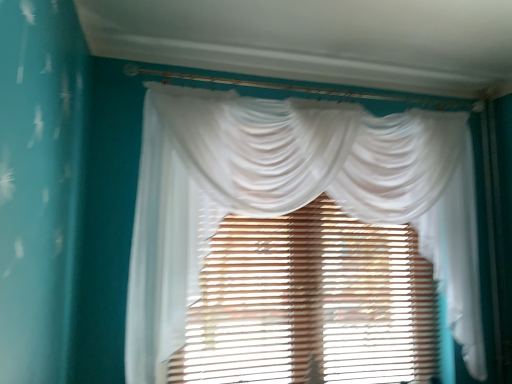
Question: Considering the relative sizes of translucent wood blinds at center and white sheer curtain at center in the image provided, is translucent wood blinds at center bigger than white sheer curtain at center?

Choices:
 (A) no
 (B) yes

Answer: (A)

Question: Is translucent wood blinds at center oriented away from white sheer curtain at center?

Choices:
 (A) no
 (B) yes

Answer: (B)

Question: Are translucent wood blinds at center and white sheer curtain at center beside each other?

Choices:
 (A) yes
 (B) no

Answer: (B)

Question: Can you confirm if translucent wood blinds at center is positioned to the right of white sheer curtain at center?

Choices:
 (A) no
 (B) yes

Answer: (A)

Question: Can you confirm if translucent wood blinds at center is smaller than white sheer curtain at center?

Choices:
 (A) yes
 (B) no

Answer: (A)

Question: Considering the relative sizes of translucent wood blinds at center and white sheer curtain at center in the image provided, is translucent wood blinds at center shorter than white sheer curtain at center?

Choices:
 (A) no
 (B) yes

Answer: (B)

Question: Is white sheer curtain at center taller than translucent wood blinds at center?

Choices:
 (A) yes
 (B) no

Answer: (A)

Question: Is white sheer curtain at center with translucent wood blinds at center?

Choices:
 (A) yes
 (B) no

Answer: (B)

Question: Considering the relative sizes of white sheer curtain at center and translucent wood blinds at center in the image provided, is white sheer curtain at center wider than translucent wood blinds at center?

Choices:
 (A) no
 (B) yes

Answer: (B)

Question: Considering the relative positions of white sheer curtain at center and translucent wood blinds at center in the image provided, is white sheer curtain at center to the right of translucent wood blinds at center from the viewer's perspective?

Choices:
 (A) no
 (B) yes

Answer: (B)

Question: Is white sheer curtain at center not near translucent wood blinds at center?

Choices:
 (A) no
 (B) yes

Answer: (A)

Question: Is white sheer curtain at center turned away from translucent wood blinds at center?

Choices:
 (A) yes
 (B) no

Answer: (A)

Question: From their relative heights in the image, would you say white sheer curtain at center is taller or shorter than translucent wood blinds at center?

Choices:
 (A) tall
 (B) short

Answer: (A)